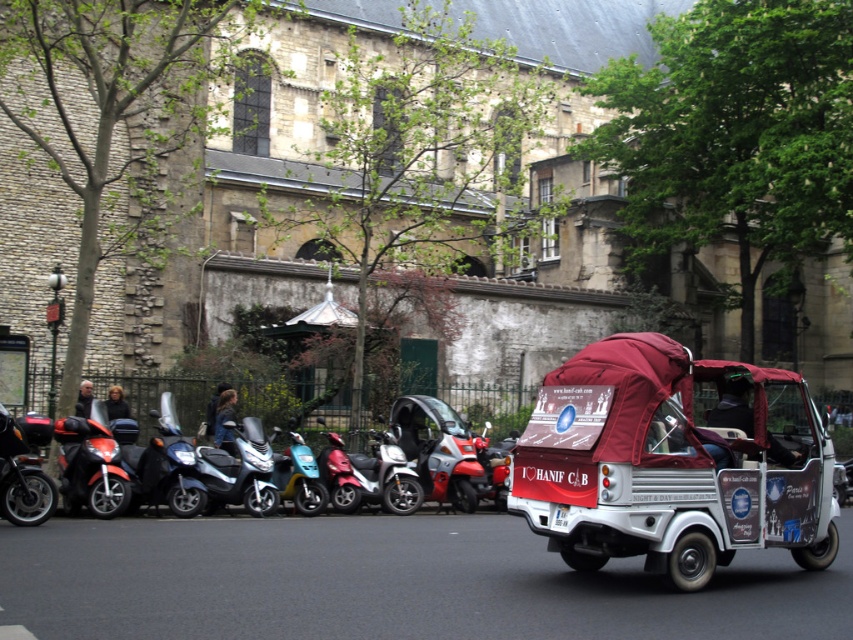
Question: Does shiny black scooter at left appear over shiny black motorcycle at left?

Choices:
 (A) yes
 (B) no

Answer: (B)

Question: Estimate the real-world distances between objects in this image. Which object is farther from the metallic blue scooter at center?

Choices:
 (A) metallic silver scooter at center
 (B) metallic silver scooter at center-left
 (C) shiny black scooter at left

Answer: (C)

Question: Is metallic silver scooter at center wider than metallic blue scooter at center?

Choices:
 (A) yes
 (B) no

Answer: (A)

Question: Which point appears farthest from the camera in this image?

Choices:
 (A) (712, 458)
 (B) (0, 460)

Answer: (B)

Question: Is shiny black scooter at left to the left of metallic silver scooter at center from the viewer's perspective?

Choices:
 (A) yes
 (B) no

Answer: (A)

Question: Among these objects, which one is nearest to the camera?

Choices:
 (A) metallic silver scooter at center-left
 (B) shiny black scooter at left
 (C) shiny black motorcycle at left

Answer: (C)